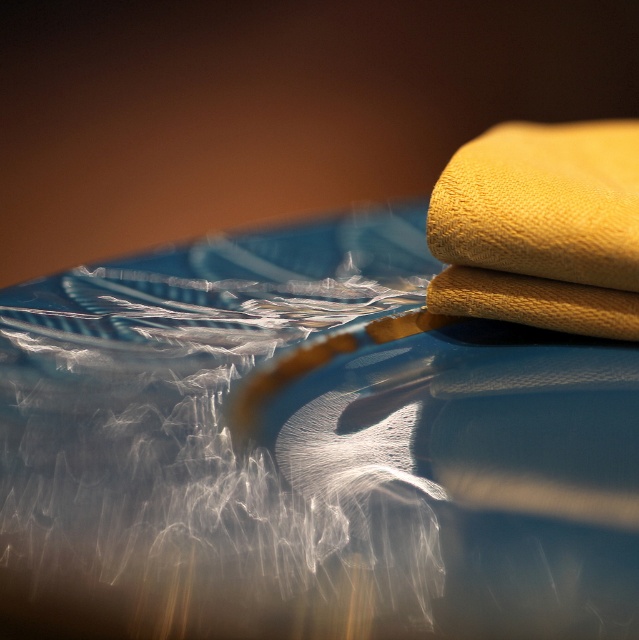
You are a delivery person who needs to place a small package on the car hood. The package is 10 cm tall. You see the translucent plastic bag at center and the yellow fabric at upper right. Which object will the package be taller than?

The translucent plastic bag at center has a greater height compared to yellow fabric at upper right. Since the package is 10 cm tall, it will be taller than the yellow fabric at upper right if the yellow fabric is shorter than 10 cm. However, without knowing the exact height of the yellow fabric, we cannot definitively determine this. Please provide more information about the yellow fabric at upper right.

You are a photographer trying to capture the reflection of the translucent plastic bag at center and the yellow fabric at upper right on the car hood. Which object should you position your camera closer to in order to focus on the one farther away?

The translucent plastic bag at center is to the left of the yellow fabric at upper right. To focus on the one farther away, you should position your camera closer to the yellow fabric at upper right since the plastic bag is closer to the camera.

You are a delivery person who needs to place a small package on the reflective surface. The package is 15 cm wide. You see the translucent plastic bag at center and the yellow fabric at upper right. Which object can the package fit next to without overlapping?

The translucent plastic bag at center has a larger width than the yellow fabric at upper right. Since the package is 15 cm wide, it can fit next to the translucent plastic bag at center as it has more space available compared to the yellow fabric at upper right.